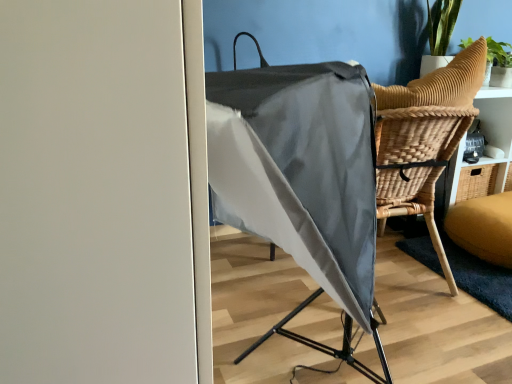
What do you see at coordinates (424, 138) in the screenshot? I see `rattan chair at center` at bounding box center [424, 138].

In order to click on rattan chair at center in this screenshot , I will do `click(424, 138)`.

The width and height of the screenshot is (512, 384). Find the location of `rattan chair at center`. rattan chair at center is located at coordinates (424, 138).